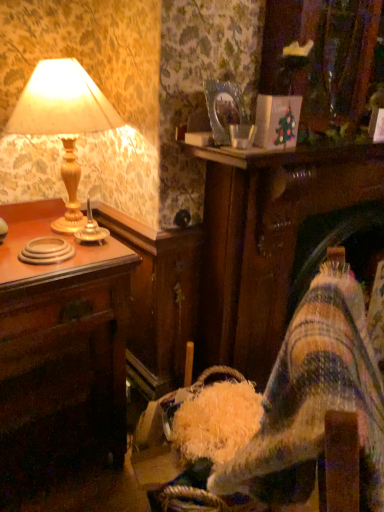
What is the approximate width of wooden desk at left?

The width of wooden desk at left is 18.95 inches.

This screenshot has height=512, width=384. I want to click on wooden desk at left, so click(x=60, y=358).

Considering the relative positions of gold metallic candle holder at left and matte gold lamp at left in the image provided, is gold metallic candle holder at left in front of matte gold lamp at left?

No.

Between gold metallic candle holder at left and matte gold lamp at left, which one has more height?

matte gold lamp at left.

You are a GUI agent. You are given a task and a screenshot of the screen. Output one action in this format:
    pyautogui.click(x=<x>, y=<y>)
    Task: Click on the lamp above the gold metallic candle holder at left (from the image's perspective)
    Image resolution: width=384 pixels, height=512 pixels.
    Given the screenshot: What is the action you would take?
    pyautogui.click(x=63, y=121)

Looking at this image, can you confirm if gold metallic candle holder at left is thinner than matte gold lamp at left?

Indeed, gold metallic candle holder at left has a lesser width compared to matte gold lamp at left.

From a real-world perspective, is matte gold lamp at left under gold metallic candle holder at left?

No, from a real-world perspective, matte gold lamp at left is not under gold metallic candle holder at left.

Is matte gold lamp at left surrounding gold metallic candle holder at left?

Absolutely, gold metallic candle holder at left is inside matte gold lamp at left.

Looking at this image, is matte gold lamp at left bigger than gold metallic candle holder at left?

Yes, matte gold lamp at left is bigger than gold metallic candle holder at left.

The image size is (384, 512). What are the coordinates of `candle holder on the right of matte gold lamp at left` in the screenshot? It's located at (91, 230).

Could wooden desk at left be considered to be inside matte gold lamp at left?

No, wooden desk at left is located outside of matte gold lamp at left.

Is matte gold lamp at left turned away from wooden desk at left?

No, matte gold lamp at left's orientation is not away from wooden desk at left.

Which is closer to the camera, [79,106] or [28,227]?

Clearly, point [79,106] is closer to the camera than point [28,227].

Is matte gold lamp at left in contact with wooden desk at left?

matte gold lamp at left and wooden desk at left are not in contact.

From a real-world perspective, is wooden desk at left on top of gold metallic candle holder at left?

Incorrect, from a real-world perspective, wooden desk at left is lower than gold metallic candle holder at left.

Do you think wooden desk at left is within gold metallic candle holder at left, or outside of it?

wooden desk at left is outside gold metallic candle holder at left.

Is wooden desk at left oriented away from gold metallic candle holder at left?

No, wooden desk at left is not facing the opposite direction of gold metallic candle holder at left.

From the image's perspective, which one is positioned lower, gold metallic candle holder at left or wooden desk at left?

wooden desk at left is shown below in the image.

From a real-world perspective, who is located lower, gold metallic candle holder at left or wooden desk at left?

wooden desk at left, from a real-world perspective.

Considering the sizes of objects gold metallic candle holder at left and wooden desk at left in the image provided, who is wider, gold metallic candle holder at left or wooden desk at left?

Wider between the two is wooden desk at left.

Based on the photo, does wooden desk at left appear on the right side of matte gold lamp at left?

No.

Would you say wooden desk at left contains matte gold lamp at left?

That's incorrect, matte gold lamp at left is not inside wooden desk at left.

From a real-world perspective, between wooden desk at left and matte gold lamp at left, who is vertically lower?

In real-world perspective, wooden desk at left is lower.

What are the coordinates of `candle holder lying behind the matte gold lamp at left` in the screenshot? It's located at (91, 230).

Find the location of `lamp above the gold metallic candle holder at left (from a real-world perspective)`. lamp above the gold metallic candle holder at left (from a real-world perspective) is located at coordinates (63, 121).

Looking at the image, which one is located further to matte gold lamp at left, gold metallic candle holder at left or wooden desk at left?

wooden desk at left.

Considering their positions, is wooden desk at left positioned further to matte gold lamp at left than gold metallic candle holder at left?

wooden desk at left is further to matte gold lamp at left.

In the scene shown: From the image, which object appears to be nearer to wooden desk at left, gold metallic candle holder at left or matte gold lamp at left?

Among the two, matte gold lamp at left is located nearer to wooden desk at left.

Looking at this image, looking at the image, which one is located closer to wooden desk at left, matte gold lamp at left or gold metallic candle holder at left?

matte gold lamp at left.

Considering their positions, is wooden desk at left positioned further to gold metallic candle holder at left than matte gold lamp at left?

Among the two, wooden desk at left is located further to gold metallic candle holder at left.

In the scene shown: Looking at the image, which one is located further to gold metallic candle holder at left, matte gold lamp at left or wooden desk at left?

The object further to gold metallic candle holder at left is wooden desk at left.

At what (x,y) coordinates should I click in order to perform the action: click on candle holder between matte gold lamp at left and wooden desk at left vertically. Please return your answer as a coordinate pair (x, y). Looking at the image, I should click on (91, 230).